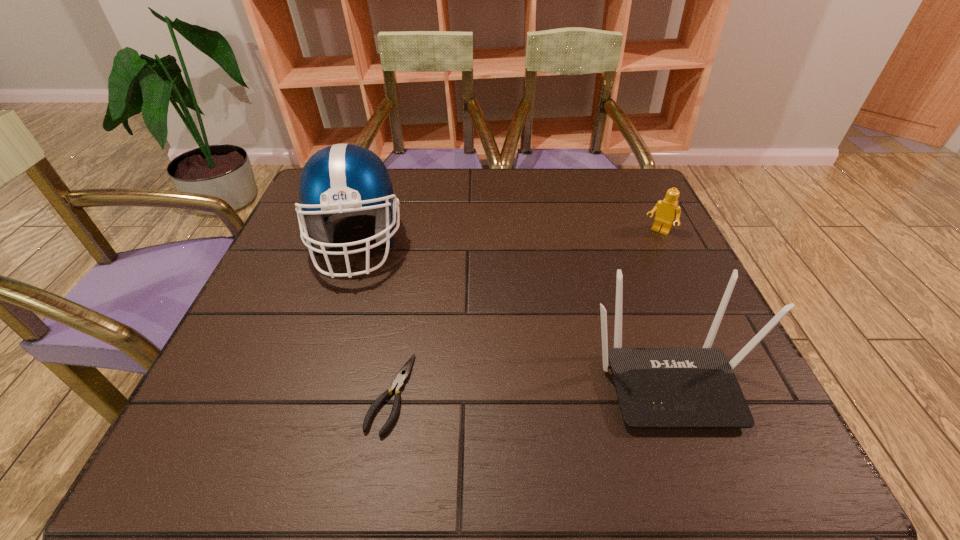
Where is `vacant spot on the desktop that is between the shortest object and the third shortest object and is positioned at the front of the football helmet with the faceguard`? This screenshot has width=960, height=540. vacant spot on the desktop that is between the shortest object and the third shortest object and is positioned at the front of the football helmet with the faceguard is located at coordinates (561, 385).

Locate an element on the screen. This screenshot has height=540, width=960. free space on the desktop that is between the pliers and the router and is positioned on the face of the Lego is located at coordinates (552, 385).